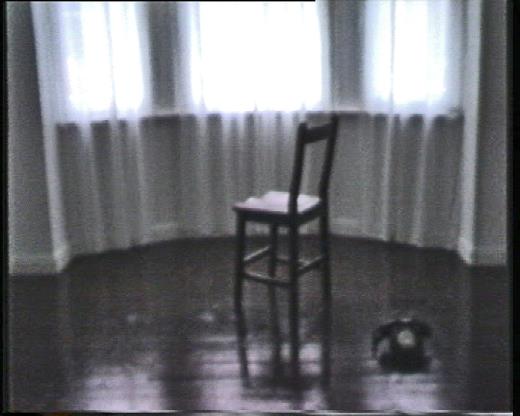
What are the coordinates of `curtain` in the screenshot? It's located at (264, 37).